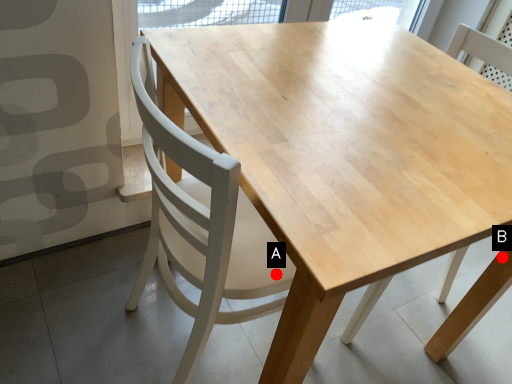
Question: Two points are circled on the image, labeled by A and B beside each circle. Which of the following is the farthest from the observer?

Choices:
 (A) A is further
 (B) B is further

Answer: (B)